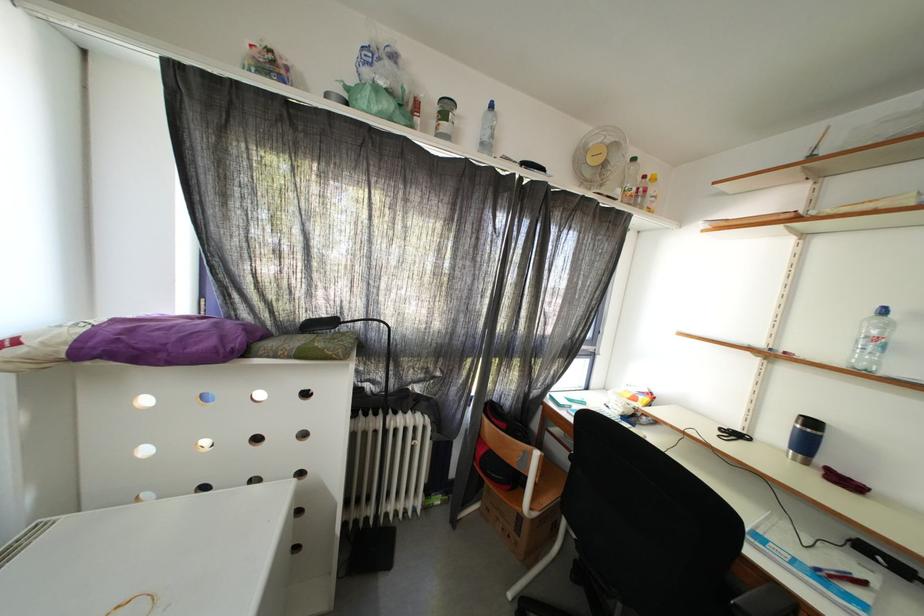
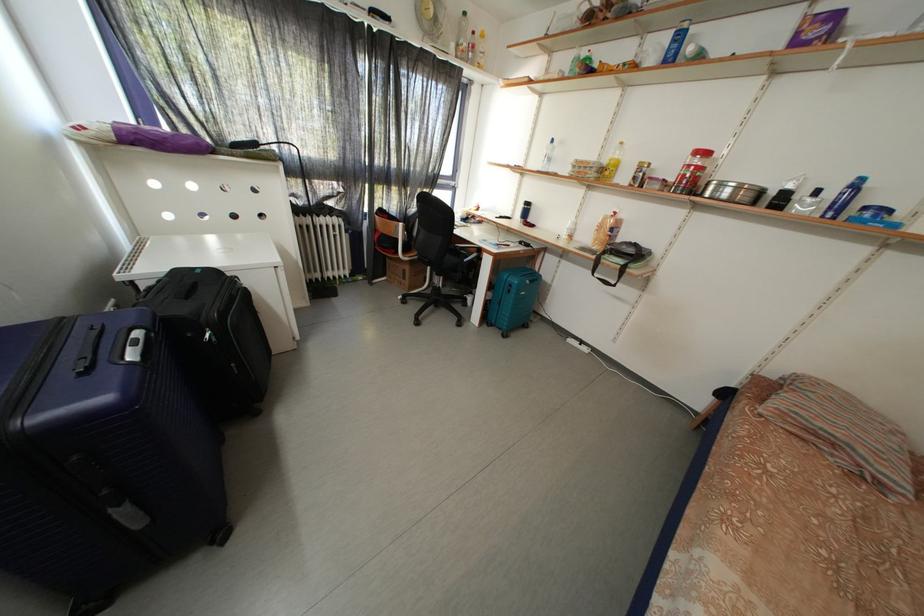
Where in the second image is the point corresponding to (311,322) from the first image?

(237, 145)